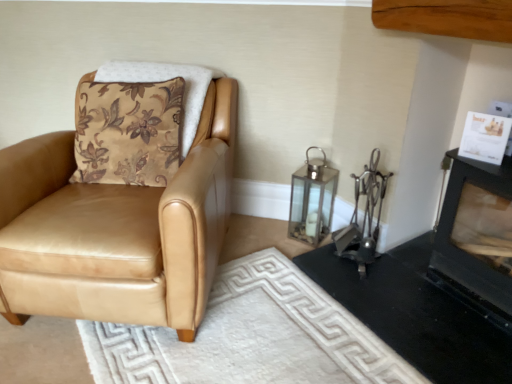
Locate an element on the screen. Image resolution: width=512 pixels, height=384 pixels. free space above black matte fireplace at lower right, which is the 1th fireplace from bottom to top (from a real-world perspective) is located at coordinates (431, 301).